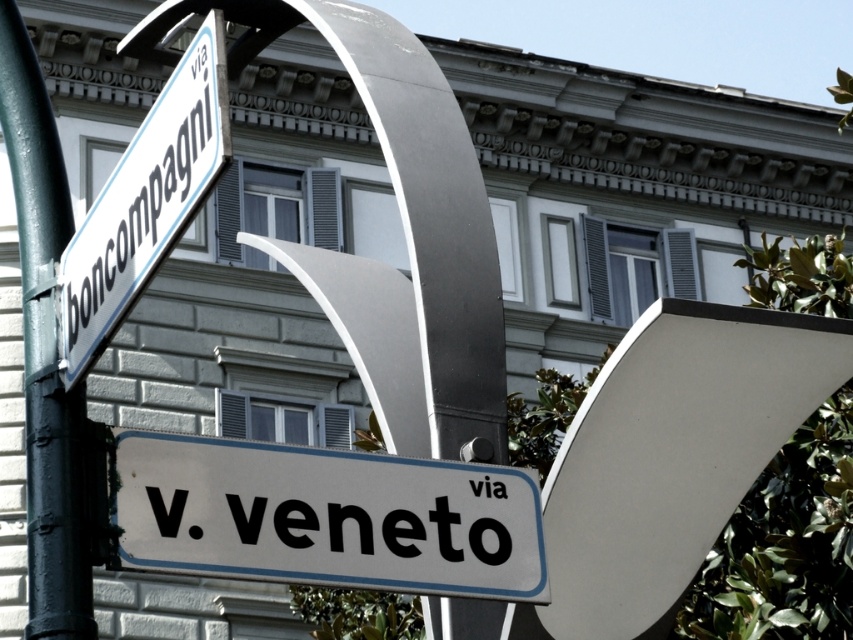
You are a city planner assessing the placement of the green painted metal pole at left and the white plastic street sign at upper left. Which object is taller?

The green painted metal pole at left is taller than the white plastic street sign at upper left according to the description.

You are a city planner assessing the street layout. You need to ensure that the green painted metal pole at left and the white plastic street sign at upper left do not block pedestrian pathways. Given that the minimum required width for a pedestrian path is 1 meter, and the pole and sign are placed side by side, can both fit within the path without exceeding the width limit?

The green painted metal pole at left is wider than the white plastic street sign at upper left. Since their combined width would exceed the 1 meter minimum requirement, they cannot both fit within the pedestrian path without blocking it.